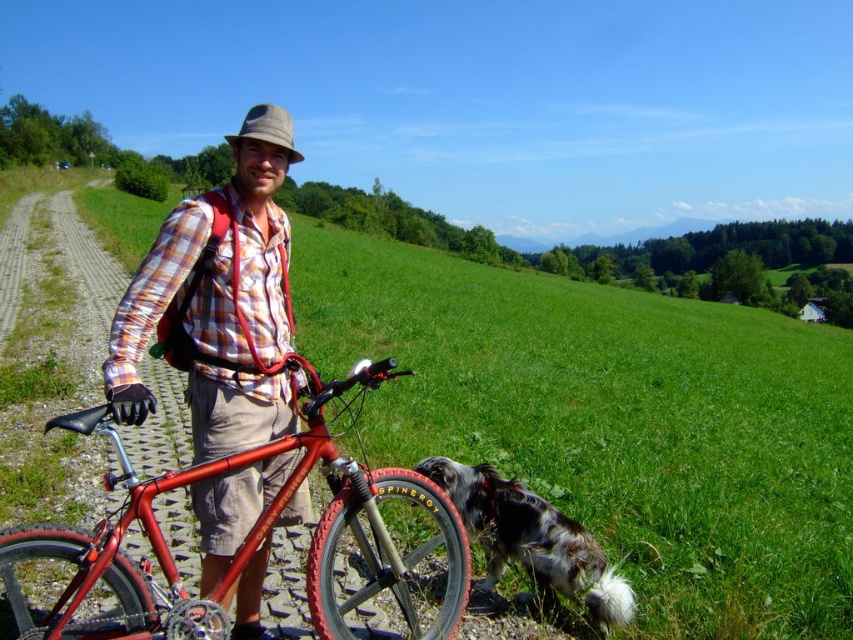
Who is shorter, matte plaid shirt at center or shiny metallic bicycle at left?

shiny metallic bicycle at left is shorter.

Is point (289, 513) in front of point (381, 544)?

No.

Does point (173, 314) come closer to viewer compared to point (462, 536)?

Yes.

I want to click on matte plaid shirt at center, so (218, 301).

Between smooth green grass at center and black and white fur at lower right, which one has more height?

smooth green grass at center

Measure the distance between smooth green grass at center and black and white fur at lower right.

smooth green grass at center and black and white fur at lower right are 35.96 feet apart.

Locate an element on the screen. smooth green grass at center is located at coordinates [x=614, y=420].

Does matte plaid shirt at center appear over black and white fur at lower right?

Indeed, matte plaid shirt at center is positioned over black and white fur at lower right.

Which of these two, matte plaid shirt at center or black and white fur at lower right, stands taller?

matte plaid shirt at center

Is point (276, 356) less distant than point (456, 508)?

Yes, point (276, 356) is in front of point (456, 508).

At what (x,y) coordinates should I click in order to perform the action: click on matte plaid shirt at center. Please return your answer as a coordinate pair (x, y). Looking at the image, I should click on (218, 301).